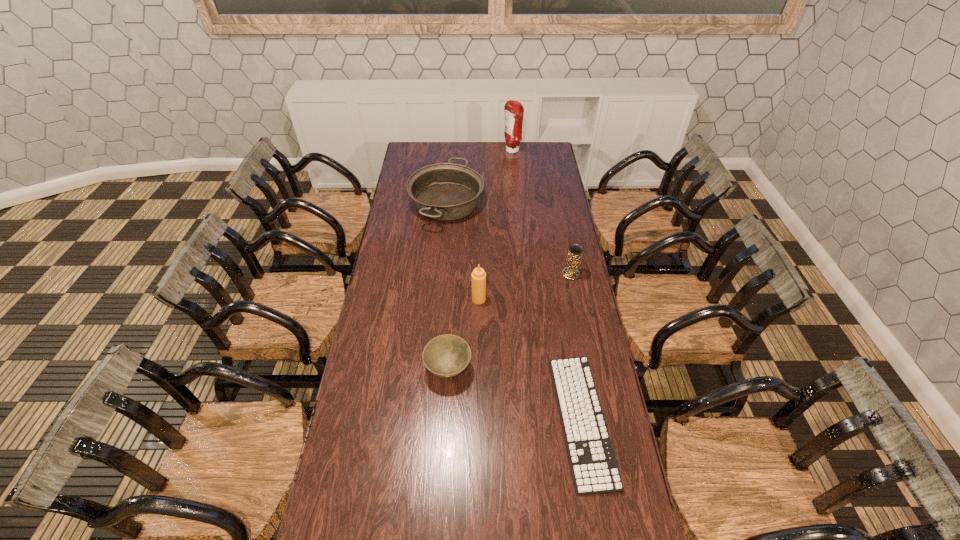
Find the location of a particular element. The image size is (960, 540). vacant space at the far edge of the desktop is located at coordinates coord(492,153).

Identify the location of free space at the left edge of the desktop. The height and width of the screenshot is (540, 960). (406, 164).

Locate an element on the screen. This screenshot has height=540, width=960. blank area at the right edge is located at coordinates (577, 343).

Locate an element on the screen. free space between the left condiment and the chalice is located at coordinates (525, 287).

Where is `unoccupied area between the fourth shortest object and the fifth nearest object`? unoccupied area between the fourth shortest object and the fifth nearest object is located at coordinates (509, 239).

Find the location of a particular element. vacant space in between the pan and the bowl is located at coordinates (447, 286).

This screenshot has width=960, height=540. What are the coordinates of `vacant space in between the fourth farthest object and the farther condiment` in the screenshot? It's located at (495, 225).

You are a GUI agent. You are given a task and a screenshot of the screen. Output one action in this format:
    pyautogui.click(x=<x>, y=<y>)
    Task: Click on the vacant area that lies between the pan and the second shortest object
    The width and height of the screenshot is (960, 540).
    Given the screenshot: What is the action you would take?
    pyautogui.click(x=447, y=286)

Find the location of a particular element. The width and height of the screenshot is (960, 540). vacant space that is in between the left condiment and the farthest object is located at coordinates (495, 225).

The height and width of the screenshot is (540, 960). Identify the location of vacant space that's between the third tallest object and the computer keyboard. (576, 347).